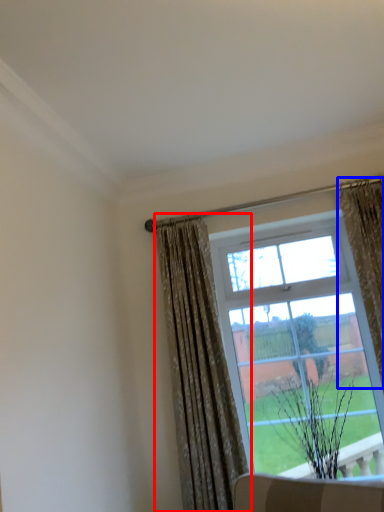
Question: Which object appears closest to the camera in this image, curtain (highlighted by a red box) or curtain (highlighted by a blue box)?

Choices:
 (A) curtain
 (B) curtain

Answer: (B)